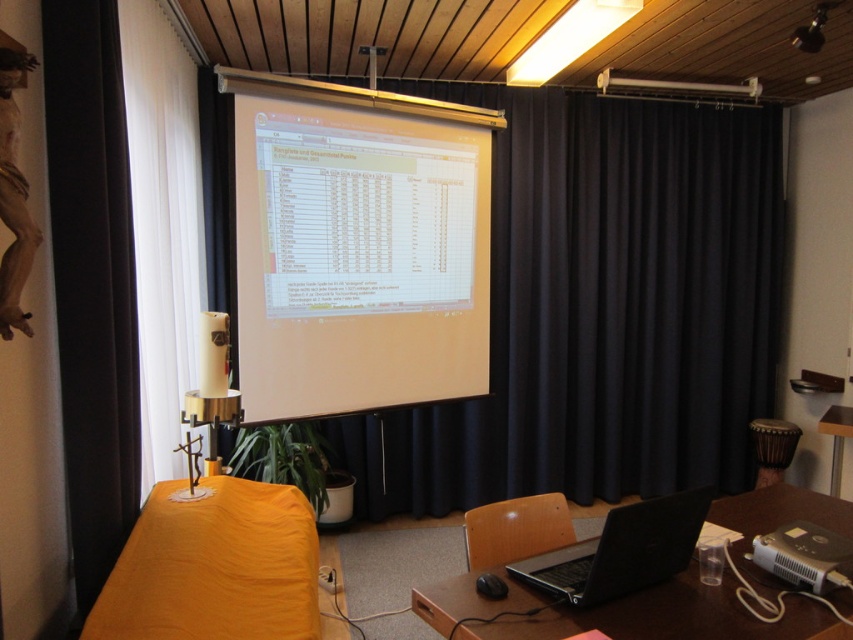
You are organizing a presentation and need to ensure that the white matte projection screen at center and the white matte speaker at upper center are positioned correctly. Based on their sizes, which object should be placed in a more prominent location to ensure visibility?

The white matte projection screen at center should be placed in a more prominent location because it has a larger size compared to the white matte speaker at upper center, making it more visible to the audience.

You are standing in the room and want to place a laptop on the brown wooden table at lower right. Given that the table is at coordinates point 0.958, 0.725, can you estimate its position relative to the projection screen?

The brown wooden table at lower right is located at point (x=618, y=612), which means it is positioned near the lower right corner of the room, making it a suitable spot to place the laptop as it is close to the table.